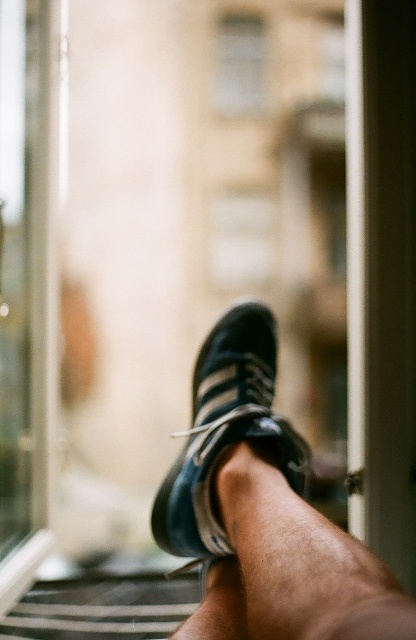
Is matte black sneaker at center smaller than black suede shoe at center?

Actually, matte black sneaker at center might be larger than black suede shoe at center.

Measure the distance between point [386,609] and camera.

40.67 centimeters

Who is more distant from viewer, (x=230, y=544) or (x=270, y=412)?

The point (x=270, y=412) is more distant.

In order to click on matte black sneaker at center in this screenshot , I will do `click(264, 512)`.

Does transparent glass door at left lie in front of black suede shoe at center?

No, transparent glass door at left is behind black suede shoe at center.

Is point (37, 500) positioned in front of point (193, 518)?

That is False.

Find the location of a particular element. Image resolution: width=416 pixels, height=640 pixels. transparent glass door at left is located at coordinates (24, 289).

Between point (269, 397) and point (32, 220), which one is positioned in front?

Point (269, 397)

I want to click on matte black sneaker at center, so click(x=264, y=512).